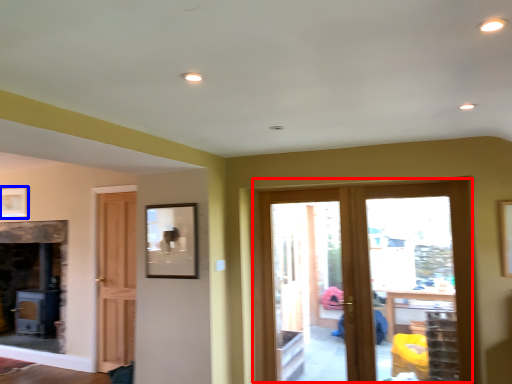
Question: Among these objects, which one is farthest to the camera, door (highlighted by a red box) or picture frame (highlighted by a blue box)?

Choices:
 (A) door
 (B) picture frame

Answer: (B)